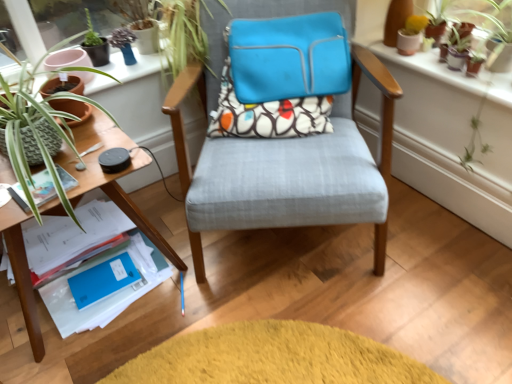
The height and width of the screenshot is (384, 512). I want to click on vacant space behind matte paper at left, placed as the second paperback book when sorted from bottom to top, so click(x=83, y=144).